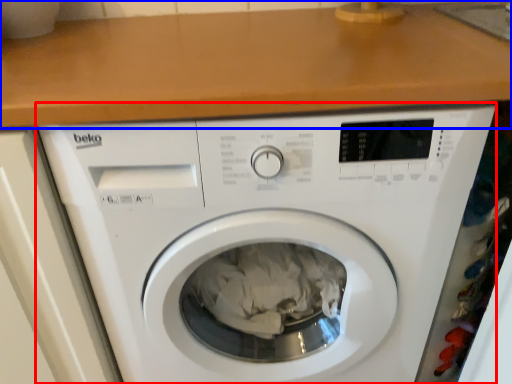
Question: Which point is further to the camera, washing machine (highlighted by a red box) or counter top (highlighted by a blue box)?

Choices:
 (A) washing machine
 (B) counter top

Answer: (A)